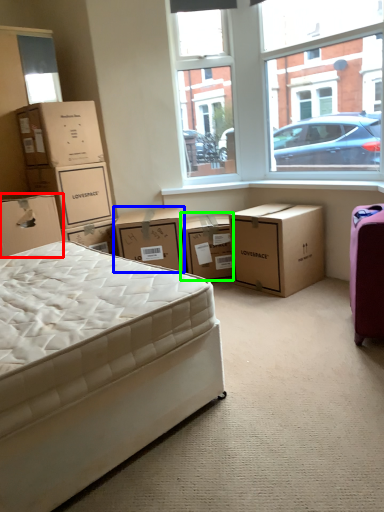
Question: Which object is positioned farthest from box (highlighted by a red box)? Select from box (highlighted by a blue box) and box (highlighted by a green box).

Choices:
 (A) box
 (B) box

Answer: (B)